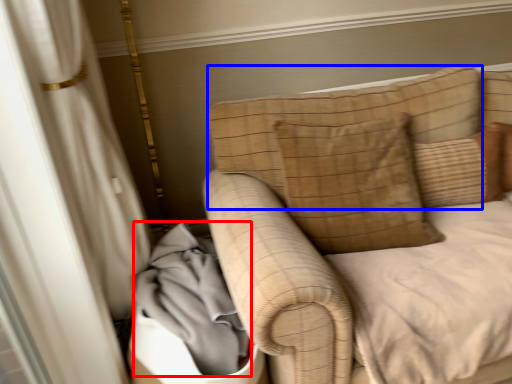
Question: Which object is closer to the camera taking this photo, material (highlighted by a red box) or pillow (highlighted by a blue box)?

Choices:
 (A) material
 (B) pillow

Answer: (A)